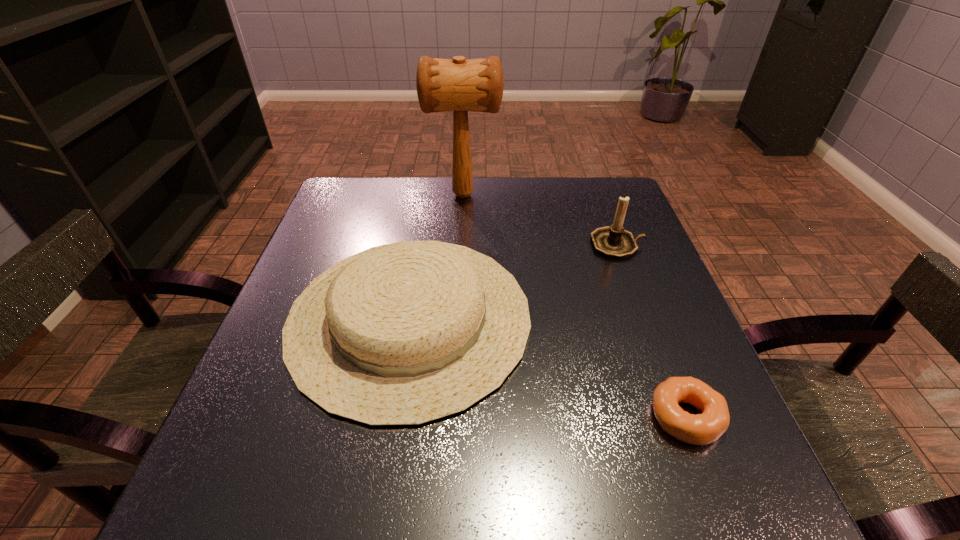
Where is `vacant space that satisfies the following two spatial constraints: 1. on the strike surface of the farthest object; 2. on the back side of the shortest object`? The width and height of the screenshot is (960, 540). vacant space that satisfies the following two spatial constraints: 1. on the strike surface of the farthest object; 2. on the back side of the shortest object is located at coordinates (451, 417).

The width and height of the screenshot is (960, 540). In order to click on vacant area in the image that satisfies the following two spatial constraints: 1. on the strike surface of the farthest object; 2. on the front side of the sunhat in this screenshot , I will do `click(457, 318)`.